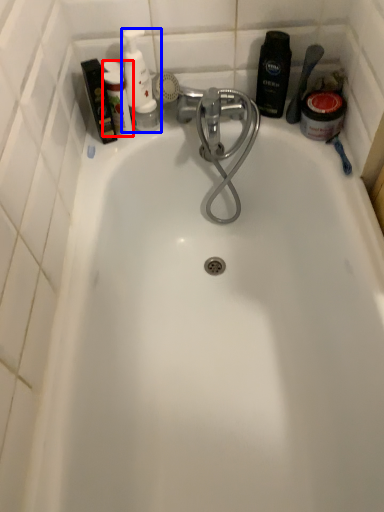
Question: Which object appears farthest to the camera in this image, toiletry (highlighted by a red box) or toiletry (highlighted by a blue box)?

Choices:
 (A) toiletry
 (B) toiletry

Answer: (B)